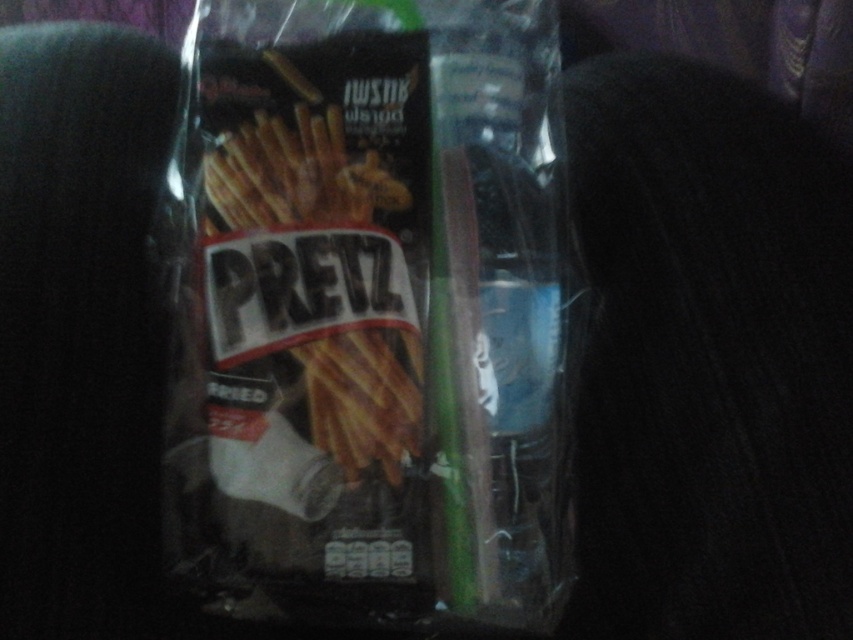
You are examining the Pretz snack bag and notice two points marked on the packaging. The first point is at coordinate point (450,148) and the second is at point (206,152). Which point is closer to you when looking at the bag?

Point (206,152) is closer to you because it is less further to the camera than point (450,148).

You are at a fast food restaurant and see a matte plastic bag at center and matte brown french fries at center. Which item is placed lower on the table?

The matte plastic bag at center is positioned under the matte brown french fries at center, so the matte plastic bag at center is placed lower on the table.

Where is the matte plastic bag at center located in the image?

The matte plastic bag at center is located at point (370,314).